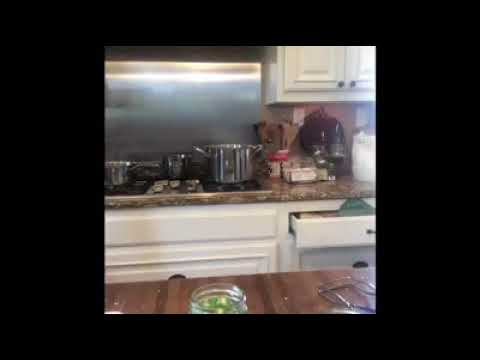
Image resolution: width=480 pixels, height=360 pixels. What are the coordinates of `pot` in the screenshot? It's located at (240, 173).